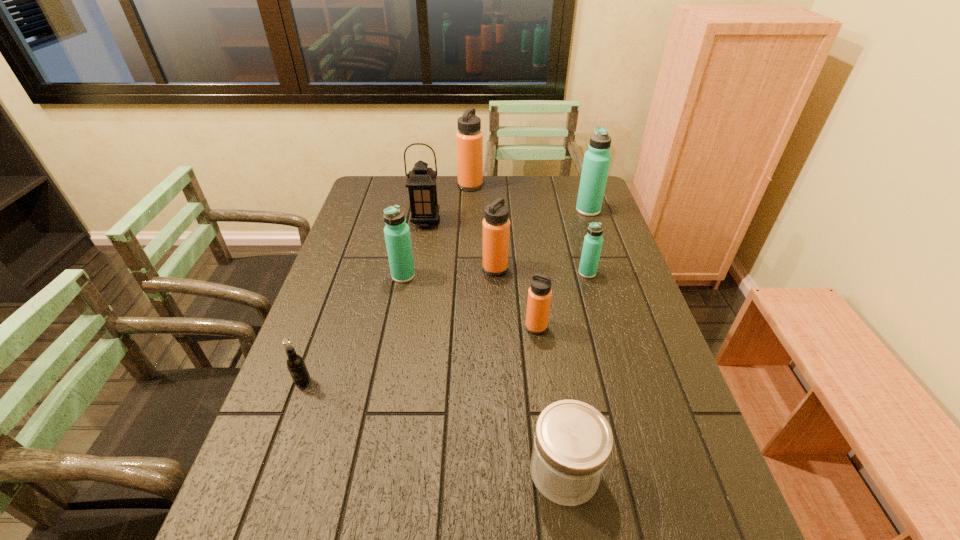
What are the coordinates of `the smallest orange thermos bottle` in the screenshot? It's located at (539, 294).

Where is `jar`? jar is located at coordinates (572, 443).

Identify the location of the eighth farthest object. (295, 363).

Locate an element on the screen. The width and height of the screenshot is (960, 540). root beer is located at coordinates (295, 363).

Image resolution: width=960 pixels, height=540 pixels. Identify the location of vacant position located 0.150m on the right of the farthest object. (520, 186).

At what (x,y) coordinates should I click in order to perform the action: click on vacant area situated 0.300m on the left of the fifth nearest thermos bottle. Please return your answer as a coordinate pair (x, y). The height and width of the screenshot is (540, 960). Looking at the image, I should click on (493, 210).

In order to click on vacant area situated on the left of the black lantern in this screenshot , I will do `click(385, 222)`.

At what (x,y) coordinates should I click in order to perform the action: click on vacant space located 0.080m on the front of the leftmost aqua thermos bottle. Please return your answer as a coordinate pair (x, y). This screenshot has height=540, width=960. Looking at the image, I should click on (398, 302).

Identify the location of vacant area situated on the front of the second smallest orange thermos bottle. This screenshot has width=960, height=540. (496, 307).

Locate an element on the screen. free spot located on the front of the smallest aqua thermos bottle is located at coordinates (601, 323).